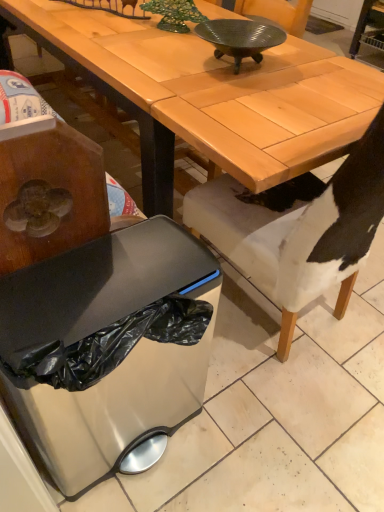
Identify the location of blank area to the left of metallic ribbed bowl at center. (156, 60).